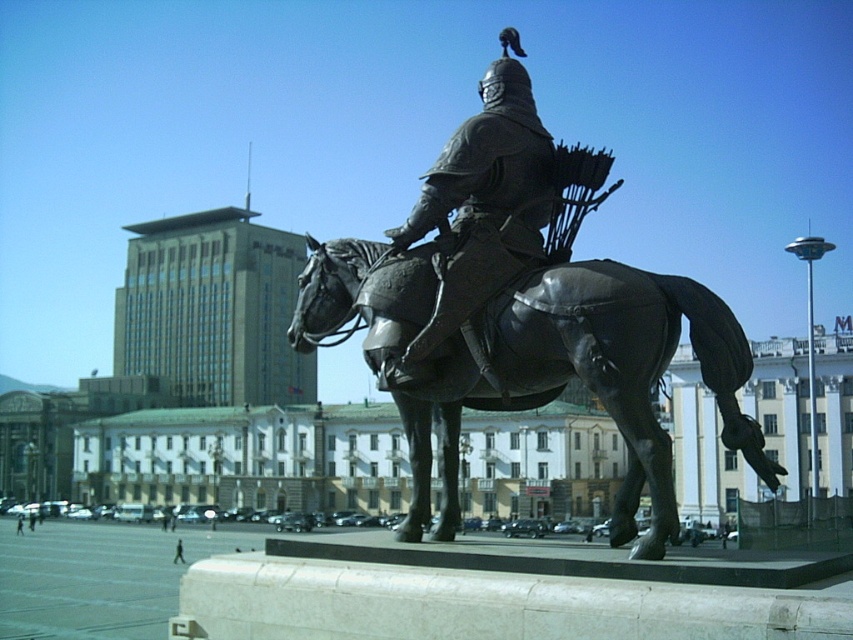
What do you see at coordinates (584, 381) in the screenshot?
I see `bronze statue at center` at bounding box center [584, 381].

Can you confirm if bronze statue at center is positioned above polished bronze statue at center?

No.

Which is behind, point (498, 365) or point (485, 289)?

Point (485, 289)

This screenshot has width=853, height=640. Identify the location of bronze statue at center. (584, 381).